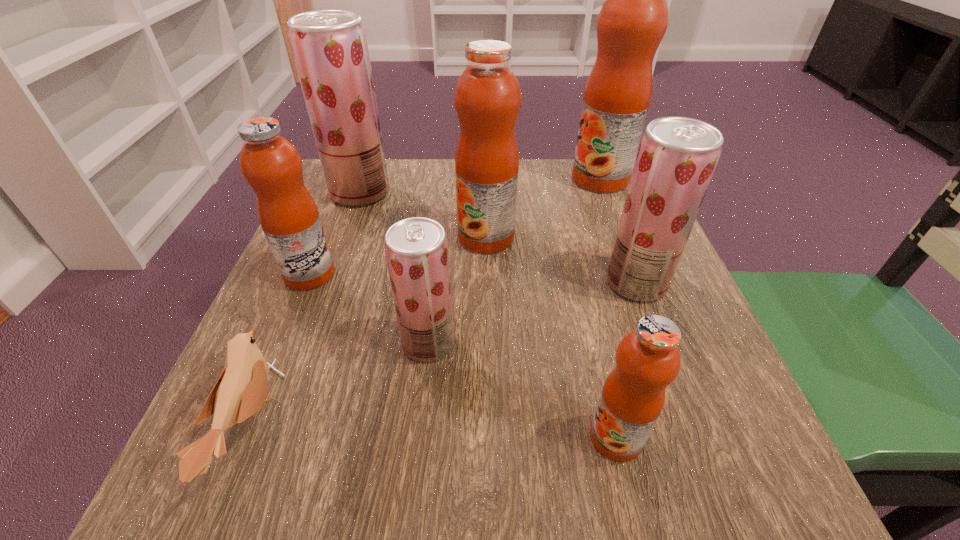
I want to click on fruit juice that is the fourth closest one to the fifth nearest fruit juice, so click(x=633, y=19).

Where is `fruit juice that is the fifth closest to the bird`? The width and height of the screenshot is (960, 540). fruit juice that is the fifth closest to the bird is located at coordinates (648, 359).

Choose which orange fruit juice is the third nearest neighbor to the second smallest orange fruit juice. Please provide its 2D coordinates. Your answer should be formatted as a tuple, i.e. [(x, y)], where the tuple contains the x and y coordinates of a point satisfying the conditions above.

[(633, 19)]

Identify which orange fruit juice is located as the nearest to the leftmost orange fruit juice. Please provide its 2D coordinates. Your answer should be formatted as a tuple, i.e. [(x, y)], where the tuple contains the x and y coordinates of a point satisfying the conditions above.

[(487, 98)]

Point out which strawberry fruit juice is positioned as the third nearest to the third farthest object. Please provide its 2D coordinates. Your answer should be formatted as a tuple, i.e. [(x, y)], where the tuple contains the x and y coordinates of a point satisfying the conditions above.

[(416, 249)]

Locate which strawberry fruit juice ranks in proximity to the tallest fruit juice. Please provide its 2D coordinates. Your answer should be formatted as a tuple, i.e. [(x, y)], where the tuple contains the x and y coordinates of a point satisfying the conditions above.

[(677, 156)]

You are a GUI agent. You are given a task and a screenshot of the screen. Output one action in this format:
    pyautogui.click(x=<x>, y=<y>)
    Task: Click on the vacant region that satisfies the following two spatial constraints: 1. on the front label of the tallest fruit juice; 2. on the front side of the nearest strawberry fruit juice
    
    Given the screenshot: What is the action you would take?
    pyautogui.click(x=662, y=343)

Locate an element on the screen. free space that satisfies the following two spatial constraints: 1. on the front label of the second strawberry fruit juice from left to right; 2. on the left side of the leftmost orange fruit juice is located at coordinates (281, 343).

This screenshot has width=960, height=540. Identify the location of free space that satisfies the following two spatial constraints: 1. on the front label of the tallest fruit juice; 2. on the front side of the farthest strawberry fruit juice. (605, 192).

The width and height of the screenshot is (960, 540). I want to click on vacant point that satisfies the following two spatial constraints: 1. on the front side of the rightmost strawberry fruit juice; 2. at the beak of the shortest object, so click(690, 426).